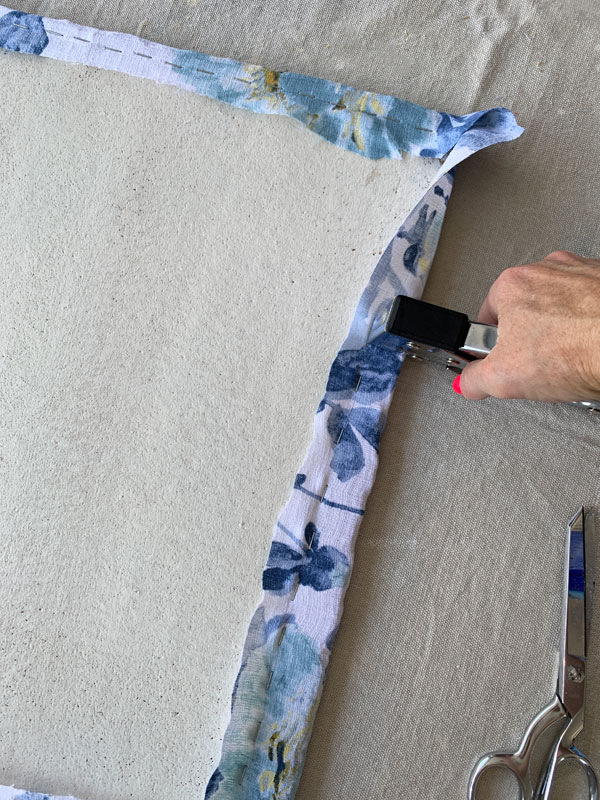
The image size is (600, 800). I want to click on grey table cloth, so click(447, 662).